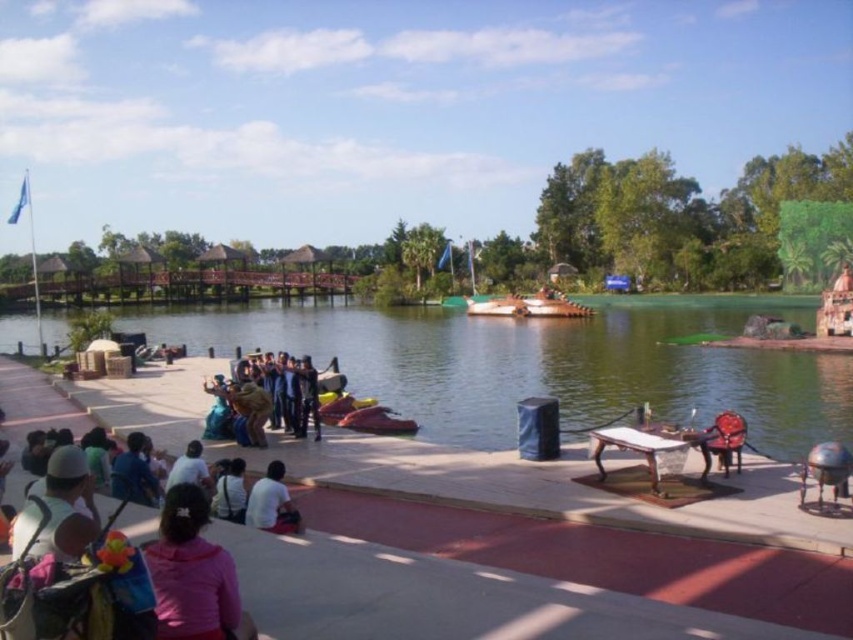
Question: Does green water at stage left appear under wooden boat at center?

Choices:
 (A) yes
 (B) no

Answer: (A)

Question: From the image, what is the correct spatial relationship of pink fabric at lower left in relation to wooden boat at center?

Choices:
 (A) right
 (B) left

Answer: (B)

Question: Among these points, which one is farthest from the camera?

Choices:
 (A) (218, 636)
 (B) (183, 253)
 (C) (0, 604)

Answer: (B)

Question: Which of these objects is positioned farthest from the wooden bridge at upper center?

Choices:
 (A) pink fabric crowd at lower left
 (B) white matte shirt at center
 (C) white matte shirt at lower center
 (D) wooden boat at center

Answer: (B)

Question: Does wooden bridge at upper center have a greater width compared to pink fabric at lower left?

Choices:
 (A) no
 (B) yes

Answer: (B)

Question: Based on their relative distances, which object is farther from the white matte shirt at lower center?

Choices:
 (A) pink fabric crowd at lower left
 (B) green water at stage left
 (C) wooden bridge at upper center
 (D) pink fabric at lower left

Answer: (C)